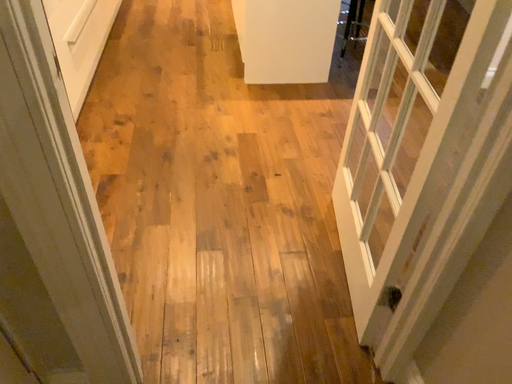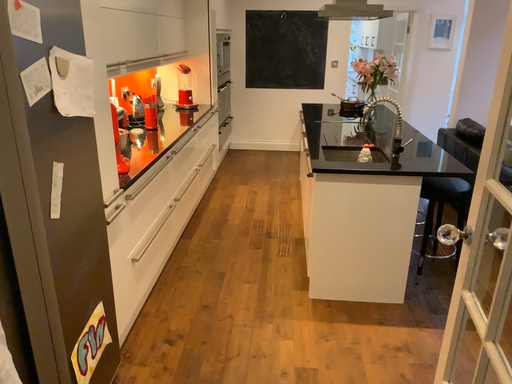
Question: How did the camera likely rotate when shooting the video?

Choices:
 (A) rotated upward
 (B) rotated downward

Answer: (A)